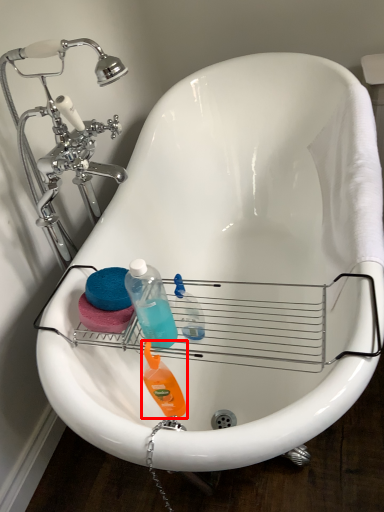
Question: Where is cleaning product (annotated by the red box) located in relation to cleaning product in the image?

Choices:
 (A) left
 (B) right

Answer: (A)